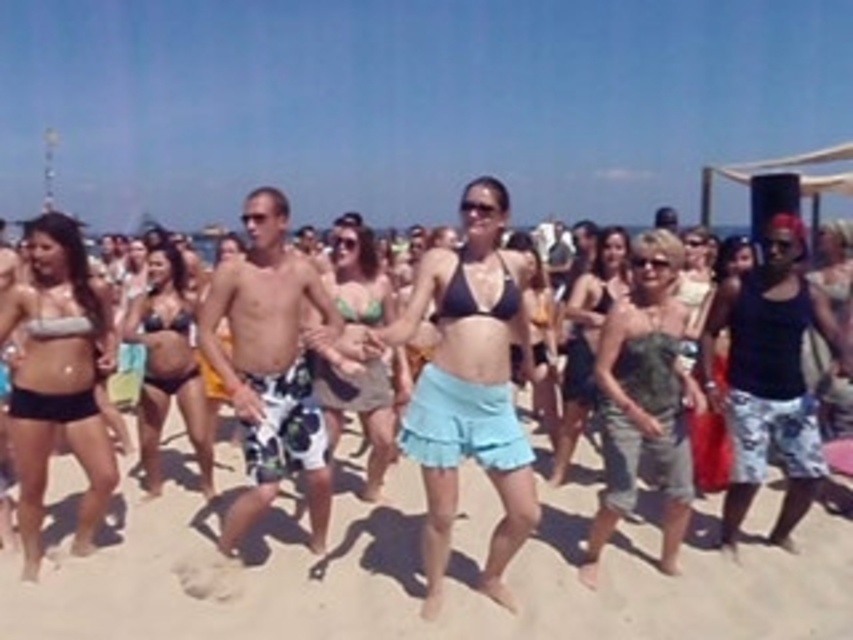
Based on the coordinates provided, which object is located at point (x=469, y=387)?

The point (x=469, y=387) corresponds to the black bikini top at center.

You are a photographer trying to capture a photo of both the matte black bikini top at left and the green bikini top at center in the same frame. The camera has a maximum focus range of 1.8 meters. Will both tops be in focus?

The matte black bikini top at left and green bikini top at center are 1.84 meters apart from each other. Since the distance exceeds the camera maximum focus range of 1.8 meters, both tops will not be in focus.

You are standing at the camera position and want to know how far the point at coordinates point (244,310) is from you. Can you determine the distance?

The distance of point (244,310) from camera is 5.30 meters.